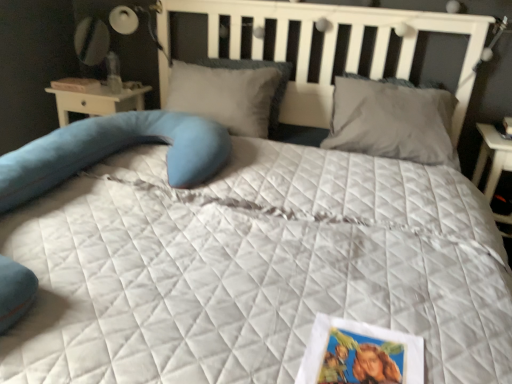
Question: Would you say gray matte pillow at upper right, placed as the second pillow when sorted from left to right, is to the left or to the right of printed paper postcard at lower right in the picture?

Choices:
 (A) left
 (B) right

Answer: (B)

Question: Relative to printed paper postcard at lower right, is gray matte pillow at upper right, the first pillow positioned from the right, in front or behind?

Choices:
 (A) behind
 (B) front

Answer: (A)

Question: Which of these objects is positioned closest to the soft gray pillow at center, placed as the 2th pillow when sorted from right to left?

Choices:
 (A) white paper book at upper left
 (B) printed paper postcard at lower right
 (C) gray matte pillow at upper right, placed as the second pillow when sorted from left to right

Answer: (C)

Question: Estimate the real-world distances between objects in this image. Which object is closer to the soft gray pillow at center, placed as the 2th pillow when sorted from right to left?

Choices:
 (A) gray matte pillow at upper right, the first pillow positioned from the right
 (B) printed paper postcard at lower right
 (C) white paper book at upper left

Answer: (A)